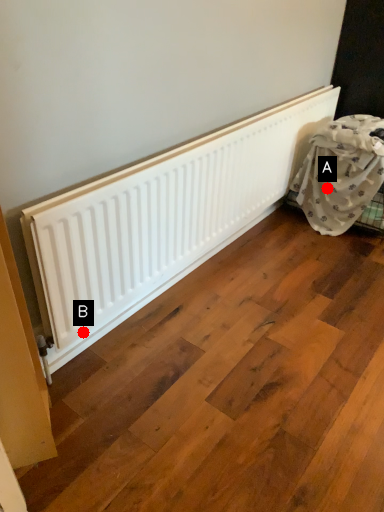
Question: Two points are circled on the image, labeled by A and B beside each circle. Which point is closer to the camera?

Choices:
 (A) A is closer
 (B) B is closer

Answer: (B)